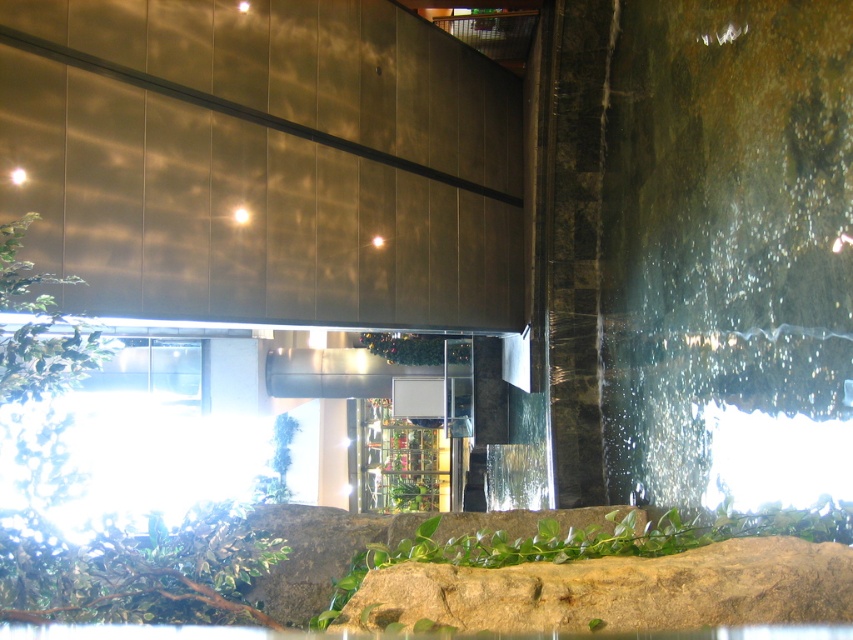
Is green leafy plant at center bigger than green glossy plant at center?

No, green leafy plant at center is not bigger than green glossy plant at center.

Is green leafy plant at center wider than green glossy plant at center?

Yes.

Does point (387, 630) come closer to viewer compared to point (416, 336)?

Yes, point (387, 630) is closer to viewer.

The height and width of the screenshot is (640, 853). Identify the location of green leafy plant at center. (589, 572).